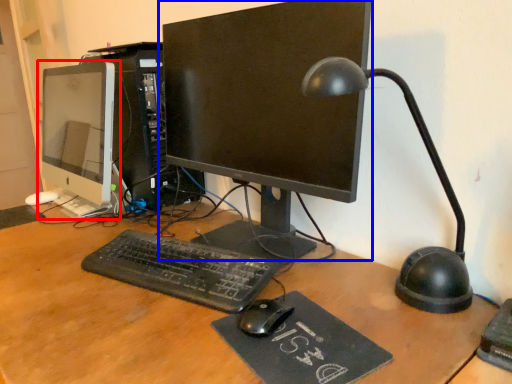
Question: Which object is closer to the camera taking this photo, computer monitor (highlighted by a red box) or computer monitor (highlighted by a blue box)?

Choices:
 (A) computer monitor
 (B) computer monitor

Answer: (B)